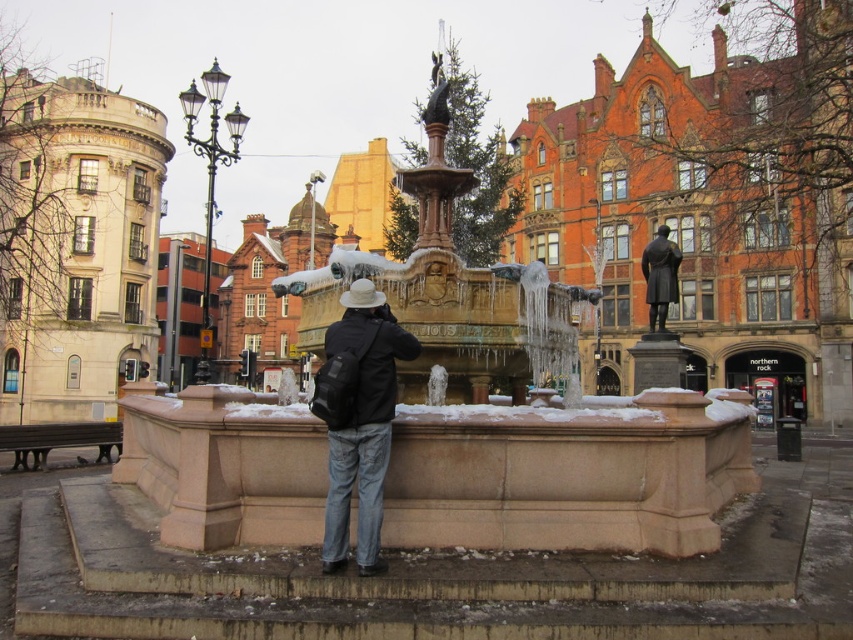
Question: Which object appears farthest from the camera in this image?

Choices:
 (A) black matte jacket at center
 (B) black polished statue at center

Answer: (B)

Question: Which of the following is the farthest from the observer?

Choices:
 (A) black polished statue at center
 (B) black matte jacket at center

Answer: (A)

Question: Does black matte jacket at center appear on the left side of black polished statue at center?

Choices:
 (A) yes
 (B) no

Answer: (A)

Question: Is black matte jacket at center thinner than black polished statue at center?

Choices:
 (A) yes
 (B) no

Answer: (A)

Question: Which of the following is the farthest from the observer?

Choices:
 (A) black polished statue at center
 (B) black matte jacket at center

Answer: (A)

Question: Is black matte jacket at center further to camera compared to black polished statue at center?

Choices:
 (A) no
 (B) yes

Answer: (A)